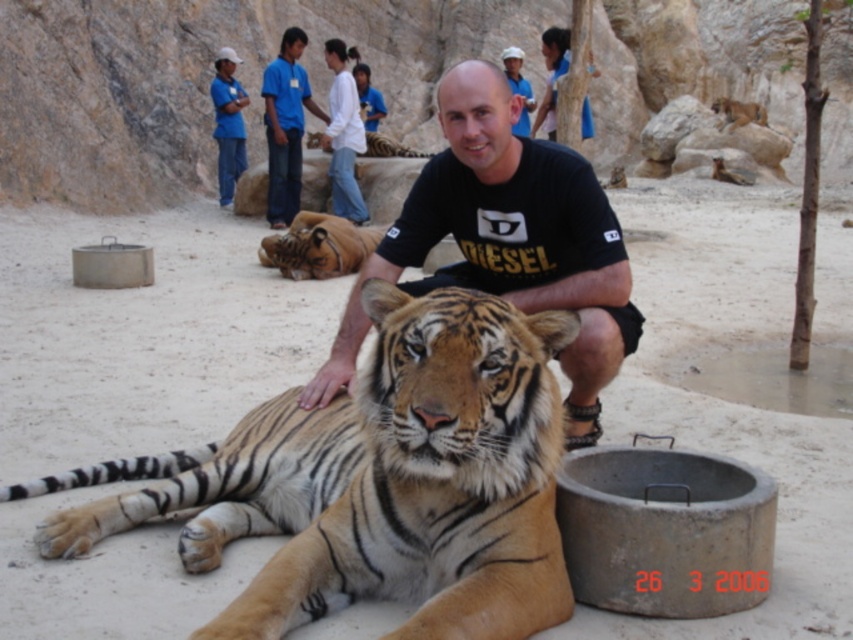
Question: Which object is closer to the camera taking this photo?

Choices:
 (A) black cotton t-shirt at center
 (B) blue cotton shirt at upper center
 (C) golden fur tiger at center
 (D) orange-brown fur tiger at center

Answer: (D)

Question: Which object is positioned closest to the orange-brown fur tiger at center?

Choices:
 (A) blue shirt at upper center
 (B) blue cotton shirt at upper center
 (C) black cotton t-shirt at center
 (D) golden fur tiger at center

Answer: (C)

Question: Can you confirm if golden fur tiger at center is positioned above blue shirt at upper center?

Choices:
 (A) yes
 (B) no

Answer: (B)

Question: Which object is closer to the camera taking this photo?

Choices:
 (A) golden fur tiger at center
 (B) blue cotton shirt at upper center
 (C) black cotton t-shirt at center

Answer: (C)

Question: Is black cotton t-shirt at center positioned behind golden fur tiger at center?

Choices:
 (A) yes
 (B) no

Answer: (B)

Question: Is orange-brown fur tiger at center smaller than black cotton t-shirt at center?

Choices:
 (A) no
 (B) yes

Answer: (A)